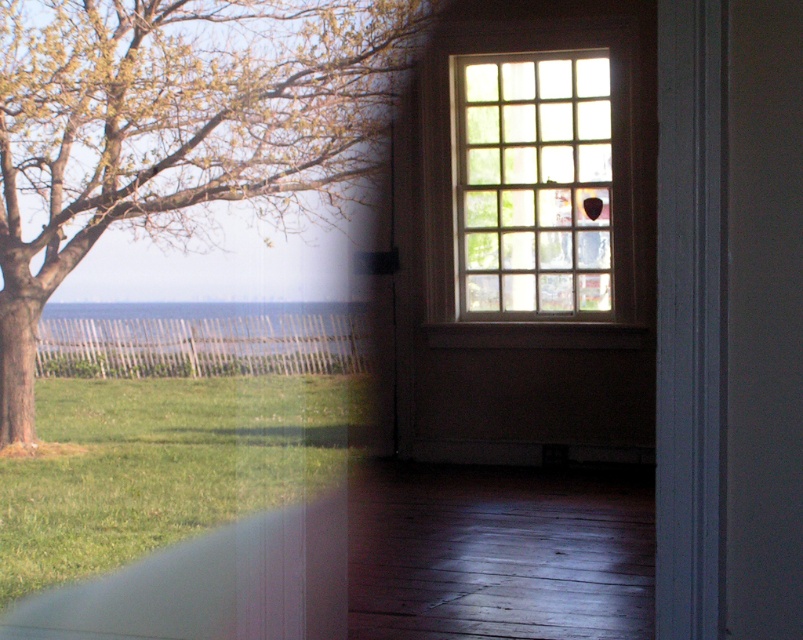
You are an interior designer planning to add a painting to the wall behind the window. The painting will feature either the green leafy tree at left or the clear blue water at center. Based on their sizes in the scene, which subject would you choose to maintain visual balance?

The green leafy tree at left is larger in size than the clear blue water at center, so choosing the green leafy tree at left would help maintain visual balance due to its prominence in the scene.